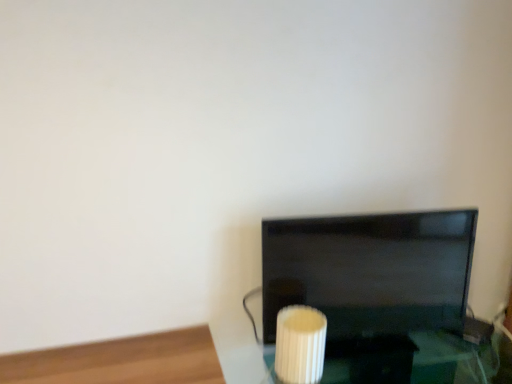
Identify the location of white ribbed glass at lower center. The image size is (512, 384). [x=300, y=344].

The image size is (512, 384). What do you see at coordinates (300, 344) in the screenshot?
I see `white ribbed glass at lower center` at bounding box center [300, 344].

This screenshot has height=384, width=512. What do you see at coordinates (370, 271) in the screenshot?
I see `black glossy tv at center` at bounding box center [370, 271].

Where is `black glossy tv at center`? The image size is (512, 384). black glossy tv at center is located at coordinates (370, 271).

Find the location of `white ribbed glass at lower center`. white ribbed glass at lower center is located at coordinates (300, 344).

Does black glossy tv at center appear on the left side of white ribbed glass at lower center?

In fact, black glossy tv at center is to the right of white ribbed glass at lower center.

Considering the positions of objects black glossy tv at center and white ribbed glass at lower center in the image provided, who is in front, black glossy tv at center or white ribbed glass at lower center?

white ribbed glass at lower center is closer to the camera.

Considering the points (365, 230) and (307, 334), which point is in front, point (365, 230) or point (307, 334)?

The point (307, 334) is in front.

From the image's perspective, is black glossy tv at center above white ribbed glass at lower center?

Yes, from the image's perspective, black glossy tv at center is over white ribbed glass at lower center.

From a real-world perspective, relative to white ribbed glass at lower center, is black glossy tv at center vertically above or below?

black glossy tv at center is situated higher than white ribbed glass at lower center in the real world.

Does black glossy tv at center have a greater width compared to white ribbed glass at lower center?

No, black glossy tv at center is not wider than white ribbed glass at lower center.

Is black glossy tv at center taller or shorter than white ribbed glass at lower center?

Clearly, black glossy tv at center is taller compared to white ribbed glass at lower center.

In the scene shown: Between black glossy tv at center and white ribbed glass at lower center, which one has larger size?

With larger size is black glossy tv at center.

Looking at this image, choose the correct answer: Is black glossy tv at center inside white ribbed glass at lower center or outside it?

black glossy tv at center exists outside the volume of white ribbed glass at lower center.

Are black glossy tv at center and white ribbed glass at lower center making contact?

There is a gap between black glossy tv at center and white ribbed glass at lower center.

Does black glossy tv at center turn towards white ribbed glass at lower center?

Yes, black glossy tv at center is aimed at white ribbed glass at lower center.

What's the angular difference between black glossy tv at center and white ribbed glass at lower center's facing directions?

The angle between the facing direction of black glossy tv at center and the facing direction of white ribbed glass at lower center is 4.01 degrees.

Measure the distance from black glossy tv at center to white ribbed glass at lower center.

black glossy tv at center is 10.10 inches from white ribbed glass at lower center.

Locate an element on the screen. candle holder that appears on the left of black glossy tv at center is located at coordinates (300, 344).

Can you confirm if white ribbed glass at lower center is positioned to the right of black glossy tv at center?

No.

Does white ribbed glass at lower center lie behind black glossy tv at center?

No, white ribbed glass at lower center is closer to the camera.

Does point (312, 344) lie in front of point (330, 326)?

Yes, it is.

From the image's perspective, is white ribbed glass at lower center under black glossy tv at center?

Yes, from the image's perspective, white ribbed glass at lower center is beneath black glossy tv at center.

From a real-world perspective, is white ribbed glass at lower center positioned above or below black glossy tv at center?

white ribbed glass at lower center is below black glossy tv at center.

Considering the sizes of objects white ribbed glass at lower center and black glossy tv at center in the image provided, who is wider, white ribbed glass at lower center or black glossy tv at center?

Wider between the two is white ribbed glass at lower center.

Is white ribbed glass at lower center shorter than black glossy tv at center?

Yes, white ribbed glass at lower center is shorter than black glossy tv at center.

Consider the image. Between white ribbed glass at lower center and black glossy tv at center, which one has smaller size?

white ribbed glass at lower center.

Is white ribbed glass at lower center inside or outside of black glossy tv at center?

white ribbed glass at lower center is spatially situated outside black glossy tv at center.

Consider the image. Are white ribbed glass at lower center and black glossy tv at center located far from each other?

That's not correct — white ribbed glass at lower center is a little close to black glossy tv at center.

Is white ribbed glass at lower center aimed at black glossy tv at center?

No, white ribbed glass at lower center is not oriented towards black glossy tv at center.

How many degrees apart are the facing directions of white ribbed glass at lower center and black glossy tv at center?

white ribbed glass at lower center and black glossy tv at center are facing 4.01 degrees away from each other.

Measure the distance between white ribbed glass at lower center and black glossy tv at center.

10.10 inches.

Find the location of a particular element. candle holder that is below the black glossy tv at center (from the image's perspective) is located at coordinates (300, 344).

Where is `television located above the white ribbed glass at lower center (from the image's perspective)`? television located above the white ribbed glass at lower center (from the image's perspective) is located at coordinates (370, 271).

Identify the location of television on the right side of white ribbed glass at lower center. The width and height of the screenshot is (512, 384). (370, 271).